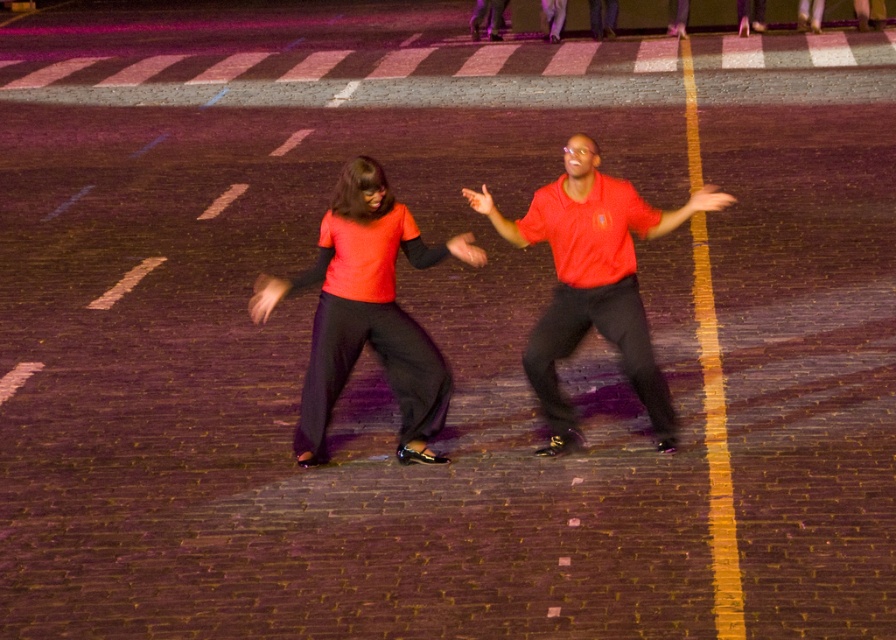
You are a photographer trying to capture a photo of both the matte orange shirt at center and the matte red shirt at center. Since you want to ensure both are fully visible in the frame, which shirt should you focus on first to avoid cropping the shorter one?

The matte orange shirt at center is shorter than the matte red shirt at center, so you should focus on positioning the matte orange shirt at center first to ensure its full height is captured before adjusting for the taller matte red shirt at center.